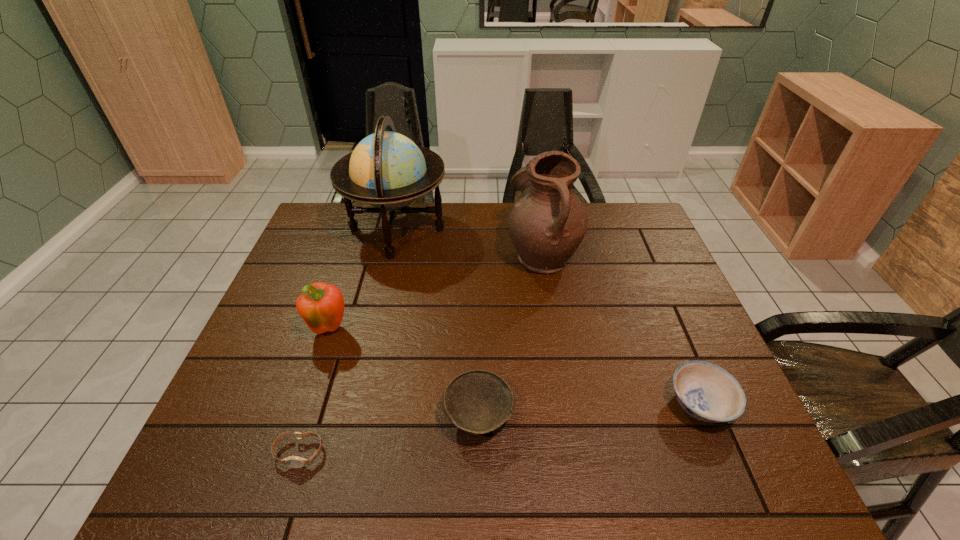
The height and width of the screenshot is (540, 960). I want to click on vacant area situated at the spout of the pitcher, so click(x=438, y=254).

Image resolution: width=960 pixels, height=540 pixels. What are the coordinates of `vacant space located at the spout of the pitcher` in the screenshot? It's located at (390, 254).

At what (x,y) coordinates should I click in order to perform the action: click on free location located 0.390m at the spout of the pitcher. Please return your answer as a coordinate pair (x, y). Image resolution: width=960 pixels, height=540 pixels. Looking at the image, I should click on (380, 254).

The height and width of the screenshot is (540, 960). I want to click on free space located 0.280m on the back of the pepper, so click(x=357, y=250).

Find the location of a particular element. This screenshot has width=960, height=540. free space located 0.330m on the back of the fourth tallest object is located at coordinates (479, 288).

Locate an element on the screen. This screenshot has height=540, width=960. free space located on the back of the rightmost object is located at coordinates (663, 317).

Locate an element on the screen. globe that is at the far edge is located at coordinates 387,170.

Locate an element on the screen. pitcher that is at the far edge is located at coordinates (546, 224).

Locate an element on the screen. This screenshot has width=960, height=540. bowl situated at the near edge is located at coordinates (478, 401).

Find the location of a particular element. watch that is at the near edge is located at coordinates (293, 461).